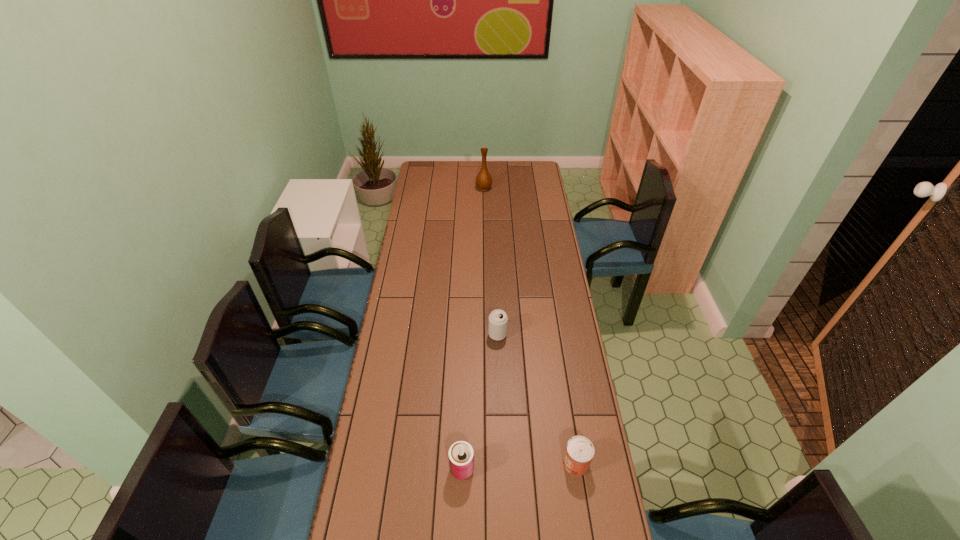
At what (x,y) coordinates should I click in order to perform the action: click on the farthest object. Please return your answer as a coordinate pair (x, y). Image resolution: width=960 pixels, height=540 pixels. Looking at the image, I should click on (484, 181).

Locate an element on the screen. This screenshot has width=960, height=540. vase is located at coordinates (484, 181).

Locate an element on the screen. the third nearest object is located at coordinates (x=498, y=319).

This screenshot has width=960, height=540. Find the location of `the second can from left to right`. the second can from left to right is located at coordinates (498, 319).

Find the location of a particular element. This screenshot has width=960, height=540. the leftmost can is located at coordinates (461, 455).

At what (x,y) coordinates should I click in order to perform the action: click on the rightmost object. Please return your answer as a coordinate pair (x, y). This screenshot has width=960, height=540. Looking at the image, I should click on (579, 452).

I want to click on vacant region located on the back of the tallest object, so click(484, 176).

Where is `free space located on the back of the second can from right to left`? This screenshot has width=960, height=540. free space located on the back of the second can from right to left is located at coordinates (496, 313).

You are a GUI agent. You are given a task and a screenshot of the screen. Output one action in this format:
    pyautogui.click(x=<x>, y=<y>)
    Task: Click on the free space located 0.310m on the back of the leftmost can
    This screenshot has width=960, height=540.
    Given the screenshot: What is the action you would take?
    pyautogui.click(x=465, y=375)

This screenshot has width=960, height=540. Identify the location of vacant space located on the front of the rightmost can. (583, 511).